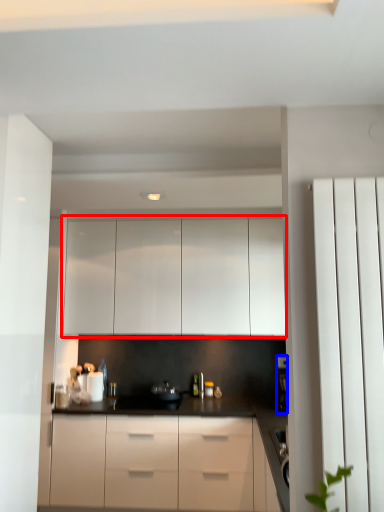
Question: Which object is closer to the camera taking this photo, cabinetry (highlighted by a red box) or coffee machine (highlighted by a blue box)?

Choices:
 (A) cabinetry
 (B) coffee machine

Answer: (B)